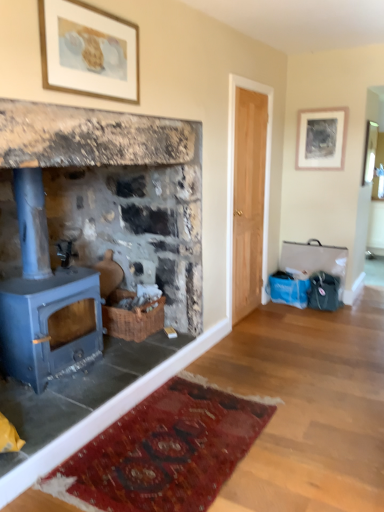
Question: From a real-world perspective, is matte blue wood burning stove at left physically located above or below gold-framed artwork at upper center, placed as the second picture frame when sorted from right to left?

Choices:
 (A) above
 (B) below

Answer: (B)

Question: From the image's perspective, relative to gold-framed artwork at upper center, which is the 2th picture frame from back to front, is matte blue wood burning stove at left above or below?

Choices:
 (A) below
 (B) above

Answer: (A)

Question: Estimate the real-world distances between objects in this image. Which object is closer to the matte silver picture frame at upper right, the first picture frame positioned from the right?

Choices:
 (A) blue painted wood stove at left
 (B) matte blue wood burning stove at left
 (C) gold-framed artwork at upper center, arranged as the first picture frame when viewed from the front

Answer: (A)

Question: Considering the real-world distances, which object is farthest from the matte silver picture frame at upper right, the first picture frame positioned from the right?

Choices:
 (A) gold-framed artwork at upper center, which is counted as the 1th picture frame, starting from the left
 (B) blue painted wood stove at left
 (C) matte blue wood burning stove at left

Answer: (C)